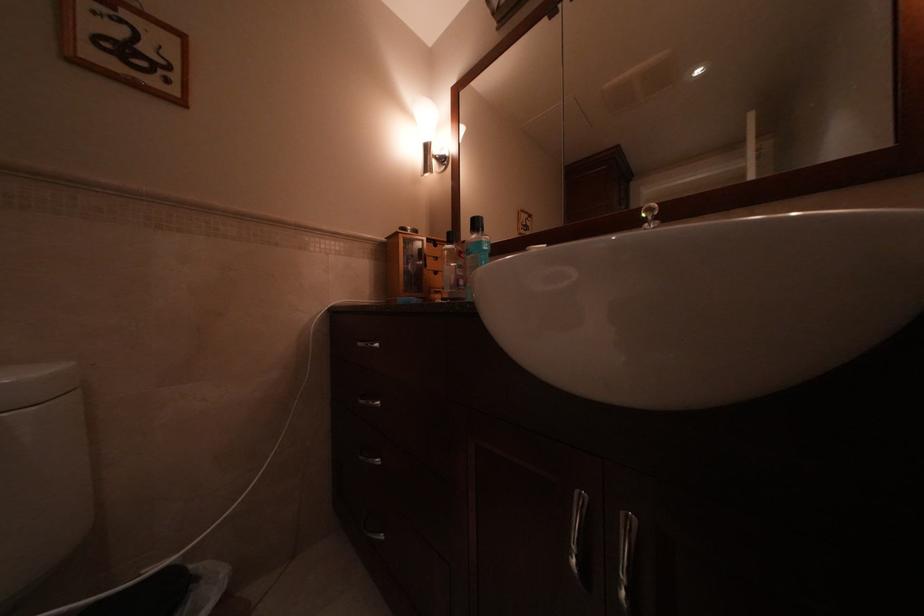
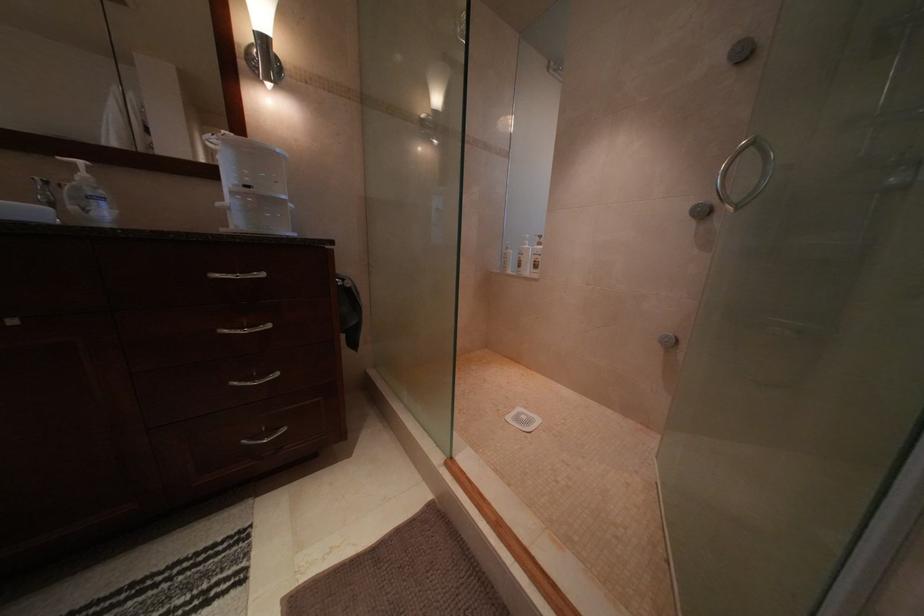
Question: Which direction would the cameraman need to move to produce the second image? Reply with the corresponding letter.

Choices:
 (A) Left
 (B) Right
 (C) Forward
 (D) Backward

Answer: (A)